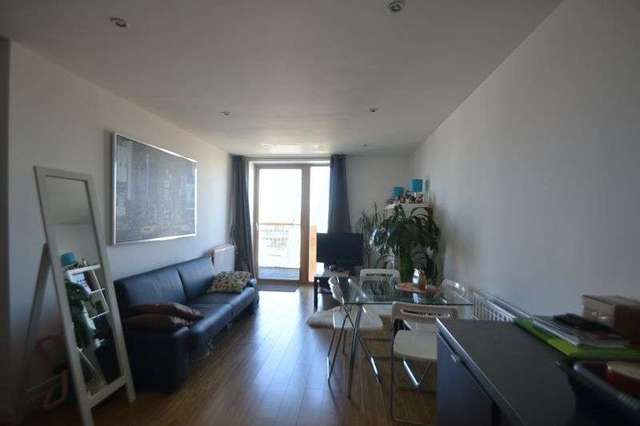
Where is `door frame`? door frame is located at coordinates (304, 245).